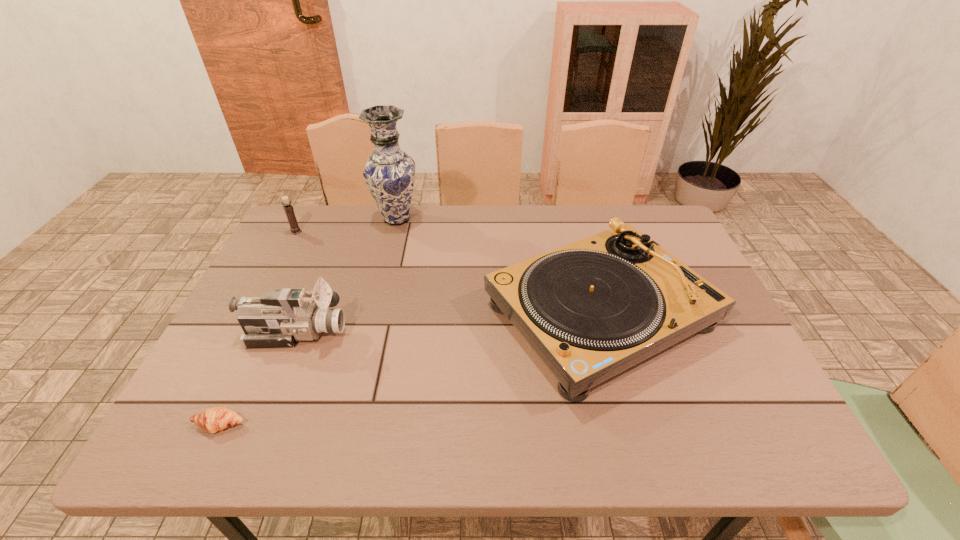
What are the coordinates of `object located in the far right corner section of the desktop` in the screenshot? It's located at (591, 309).

In the image, there is a desktop. At what (x,y) coordinates should I click in order to perform the action: click on vacant area at the far edge. Please return your answer as a coordinate pair (x, y). Looking at the image, I should click on (361, 210).

You are a GUI agent. You are given a task and a screenshot of the screen. Output one action in this format:
    pyautogui.click(x=<x>, y=<y>)
    Task: Click on the vacant space at the near edge
    The height and width of the screenshot is (540, 960).
    Given the screenshot: What is the action you would take?
    pyautogui.click(x=570, y=448)

The height and width of the screenshot is (540, 960). In the image, there is a desktop. What are the coordinates of `free space at the left edge` in the screenshot? It's located at (299, 264).

Image resolution: width=960 pixels, height=540 pixels. Identify the location of vacant space at the right edge of the desktop. (700, 394).

The height and width of the screenshot is (540, 960). Find the location of `vacant area at the near left corner of the desktop`. vacant area at the near left corner of the desktop is located at coordinates (198, 430).

I want to click on free spot between the vase and the candle holder, so (347, 225).

Locate an element on the screen. The width and height of the screenshot is (960, 540). unoccupied area between the tallest object and the candle holder is located at coordinates (347, 225).

This screenshot has height=540, width=960. Identify the location of vacant region between the pastry and the camcorder. (258, 379).

In order to click on empty space between the candle holder and the camcorder in this screenshot , I will do `click(296, 282)`.